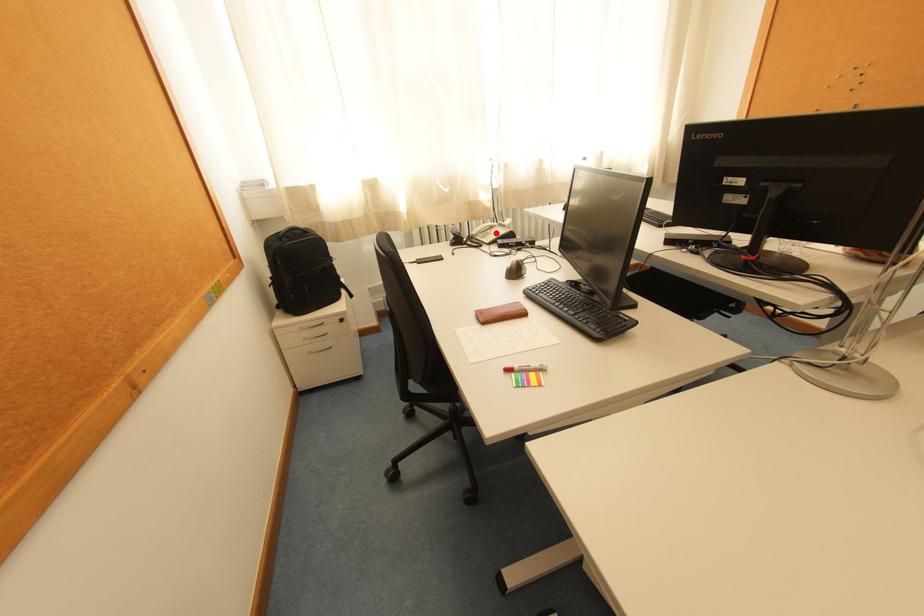
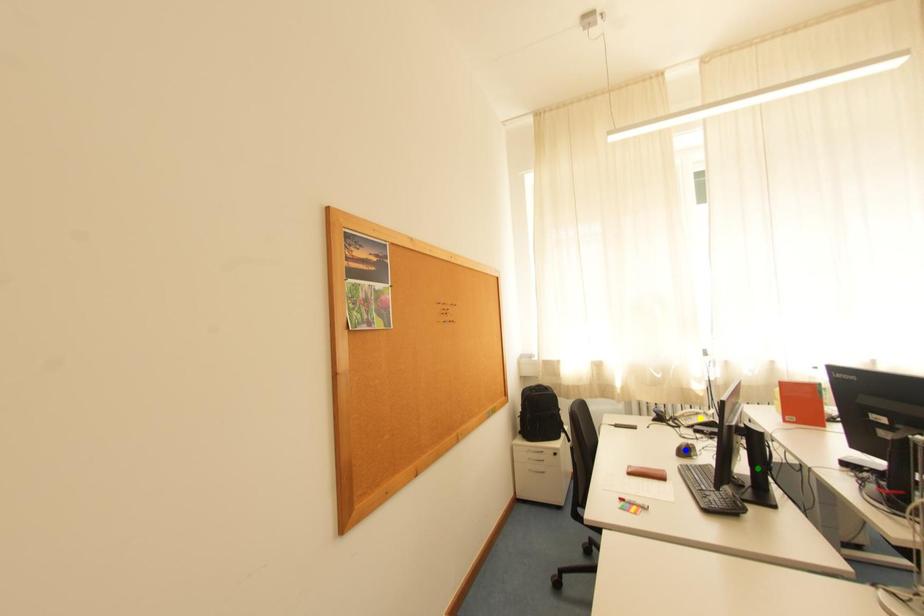
Question: I am providing you with two images of the same scene from different viewpoints. A red point is marked on the first image. You are given multiple points on the second image. In image 2, which mark is for the same physical point as the one in image 1?

Choices:
 (A) green point
 (B) blue point
 (C) yellow point

Answer: (C)